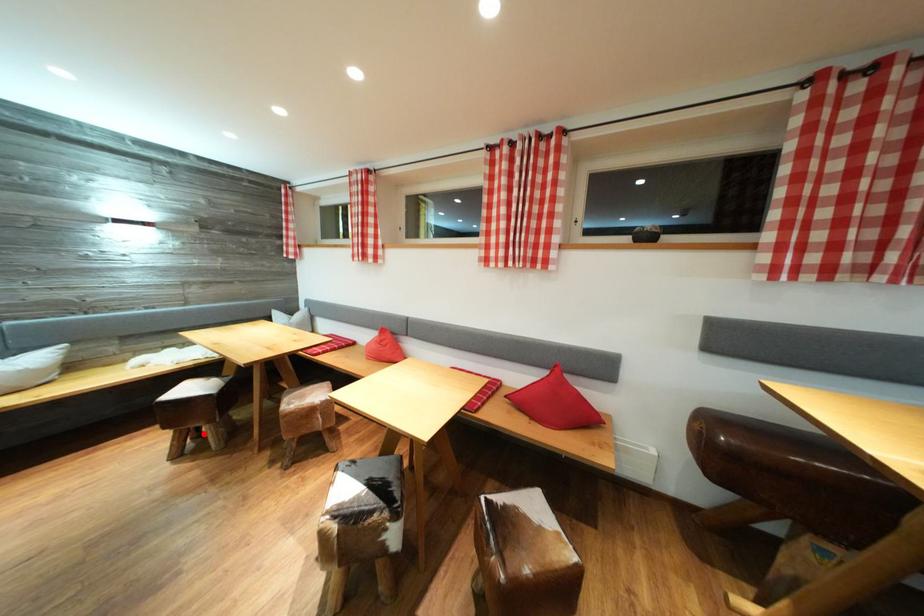
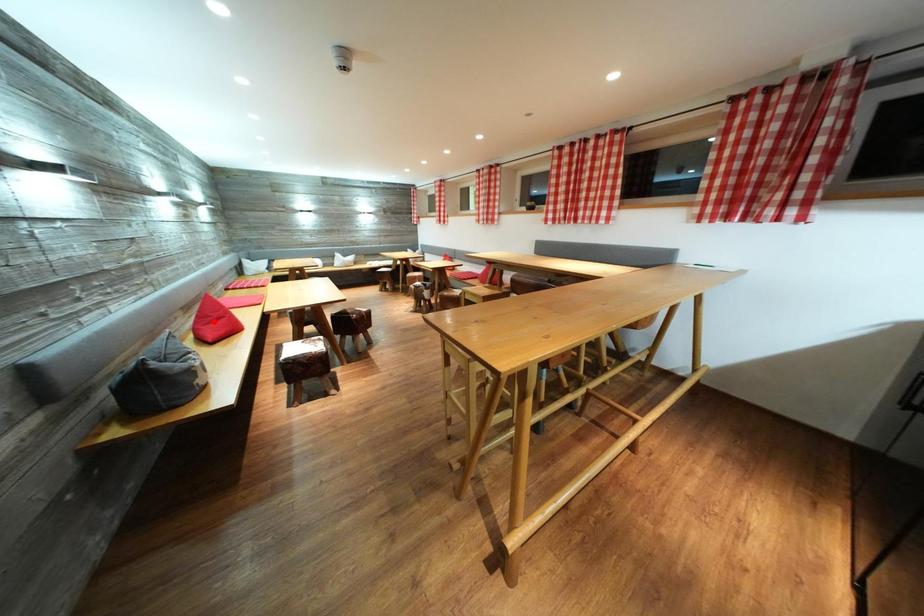
I am providing you with two images of the same scene from different viewpoints. A red point is marked on the first image and another point is marked on the second image. Does the point marked in image1 correspond to the same location as the one in image2?

No